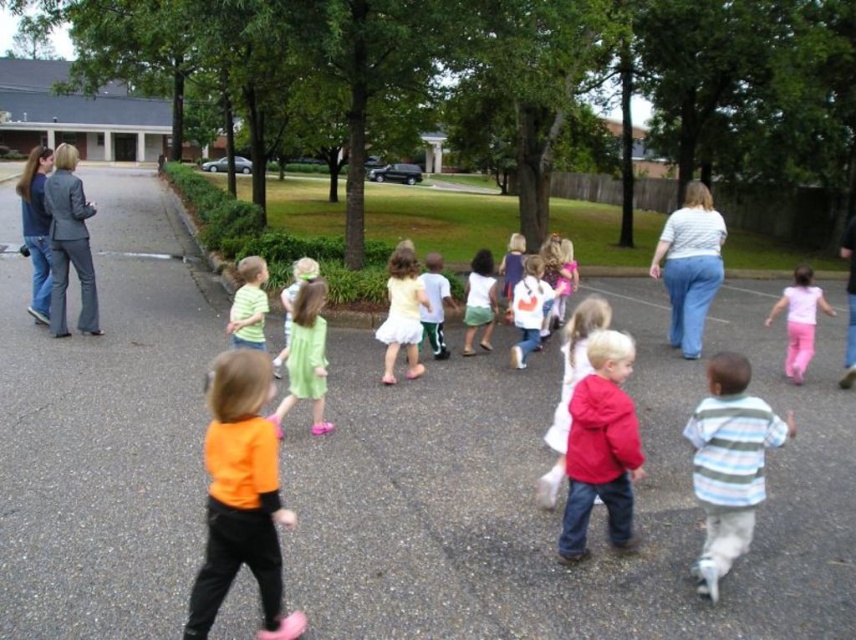
Measure the distance between point [387,381] and camera.

Point [387,381] is 7.77 meters from camera.

Between matte yellow dress at center and matte green shirt at center, which one is positioned lower?

matte yellow dress at center is below.

Is point (407, 266) farther from viewer compared to point (262, 342)?

Yes, point (407, 266) is behind point (262, 342).

You are a GUI agent. You are given a task and a screenshot of the screen. Output one action in this format:
    pyautogui.click(x=<x>, y=<y>)
    Task: Click on the matte yellow dress at center
    The width and height of the screenshot is (856, 640).
    Given the screenshot: What is the action you would take?
    pos(402,312)

Looking at this image, which is more to the left, striped cotton shirt at lower right or matte red hoodie at center?

matte red hoodie at center

Between striped cotton shirt at lower right and matte red hoodie at center, which one has more height?

matte red hoodie at center

The width and height of the screenshot is (856, 640). In order to click on striped cotton shirt at lower right in this screenshot , I will do `click(729, 464)`.

Where is `striped cotton shirt at lower right`? The image size is (856, 640). striped cotton shirt at lower right is located at coordinates (729, 464).

Which of these two, white cotton shirt at center or green satin dress at center, stands shorter?

green satin dress at center is shorter.

Who is lower down, white cotton shirt at center or green satin dress at center?

white cotton shirt at center is lower down.

Does point (527, 349) come in front of point (314, 275)?

No, (527, 349) is further to viewer.

Identify the location of white cotton shirt at center. (528, 308).